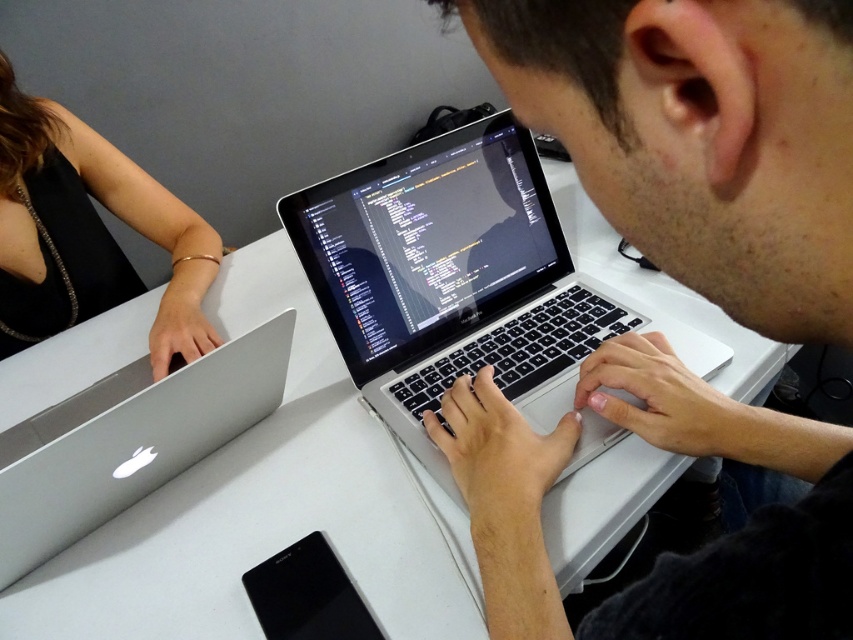
Is white glossy table at center wider than silver/black keyboard at center?

Correct, the width of white glossy table at center exceeds that of silver/black keyboard at center.

Does white glossy table at center come in front of silver/black keyboard at center?

Yes.

Does point (252, 307) come behind point (491, 308)?

That is True.

You are a GUI agent. You are given a task and a screenshot of the screen. Output one action in this format:
    pyautogui.click(x=<x>, y=<y>)
    Task: Click on the white glossy table at center
    The width and height of the screenshot is (853, 640).
    Given the screenshot: What is the action you would take?
    pyautogui.click(x=264, y=506)

Measure the distance from silver/black keyboard at center to black fabric arm at upper left.

They are 16.53 inches apart.

Between silver/black keyboard at center and black fabric arm at upper left, which one is positioned higher?

black fabric arm at upper left is higher up.

This screenshot has height=640, width=853. What do you see at coordinates (451, 280) in the screenshot? I see `silver/black keyboard at center` at bounding box center [451, 280].

Where is `silver/black keyboard at center`? This screenshot has width=853, height=640. silver/black keyboard at center is located at coordinates 451,280.

Who is lower down, silver/black keyboard at center or silver metallic laptop at left?

silver metallic laptop at left

What are the coordinates of `silver/black keyboard at center` in the screenshot? It's located at (451, 280).

This screenshot has height=640, width=853. Identify the location of silver/black keyboard at center. (451, 280).